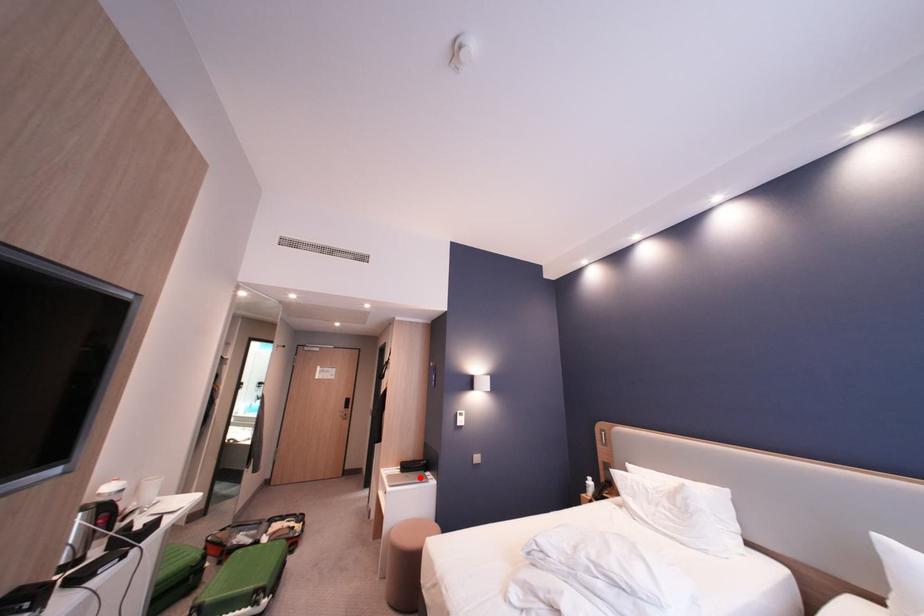
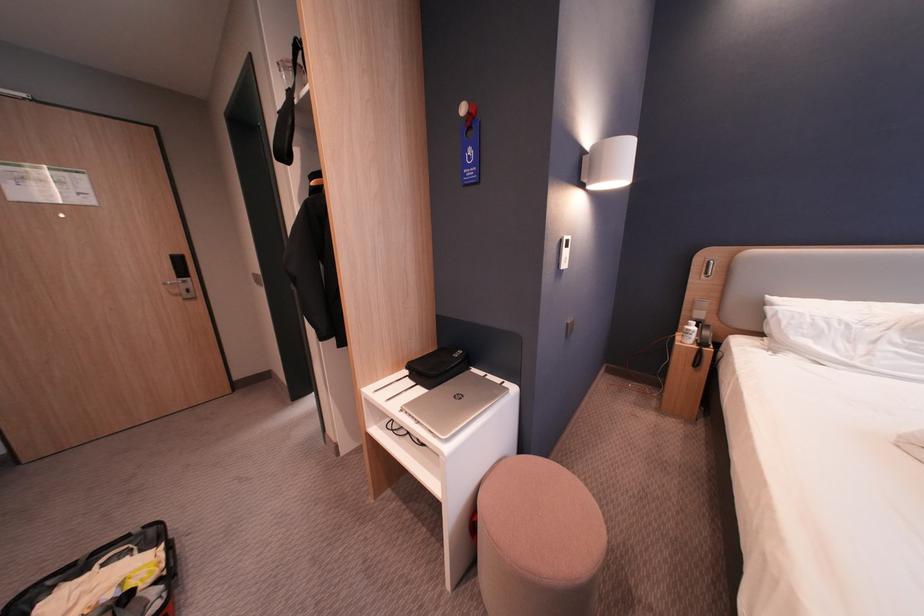
The point at the highlighted location is marked in the first image. Where is the corresponding point in the second image?

(475, 397)